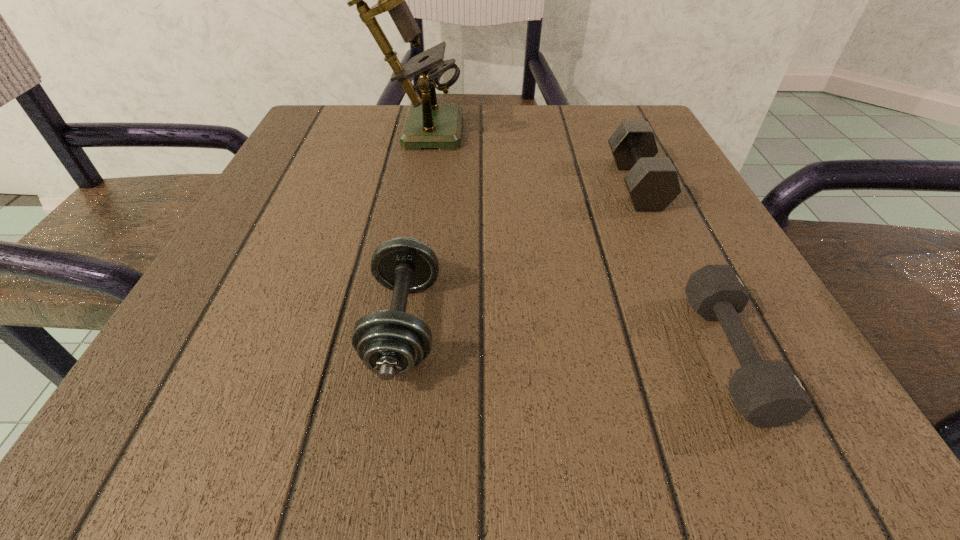
You are a GUI agent. You are given a task and a screenshot of the screen. Output one action in this format:
    pyautogui.click(x=<x>, y=<y>)
    Task: Click on the tallest object
    The image size is (960, 540).
    Given the screenshot: What is the action you would take?
    pyautogui.click(x=428, y=124)

Where is `microscope`? Image resolution: width=960 pixels, height=540 pixels. microscope is located at coordinates (428, 124).

Where is `the leftmost dumbbell`? Image resolution: width=960 pixels, height=540 pixels. the leftmost dumbbell is located at coordinates (390, 343).

I want to click on the second farthest object, so click(652, 183).

The width and height of the screenshot is (960, 540). I want to click on the shortest dumbbell, so click(768, 393).

Find the location of a particular element. vacant space positioned at the eyepiece of the microscope is located at coordinates (592, 127).

Locate an element on the screen. blank space located on the left of the leftmost dumbbell is located at coordinates (224, 324).

Find the location of a particular element. vacant space located on the front of the third nearest object is located at coordinates (732, 397).

Where is `free space located on the back of the shortest dumbbell`? Image resolution: width=960 pixels, height=540 pixels. free space located on the back of the shortest dumbbell is located at coordinates (647, 182).

This screenshot has height=540, width=960. In order to click on microscope that is at the far edge in this screenshot , I will do `click(428, 124)`.